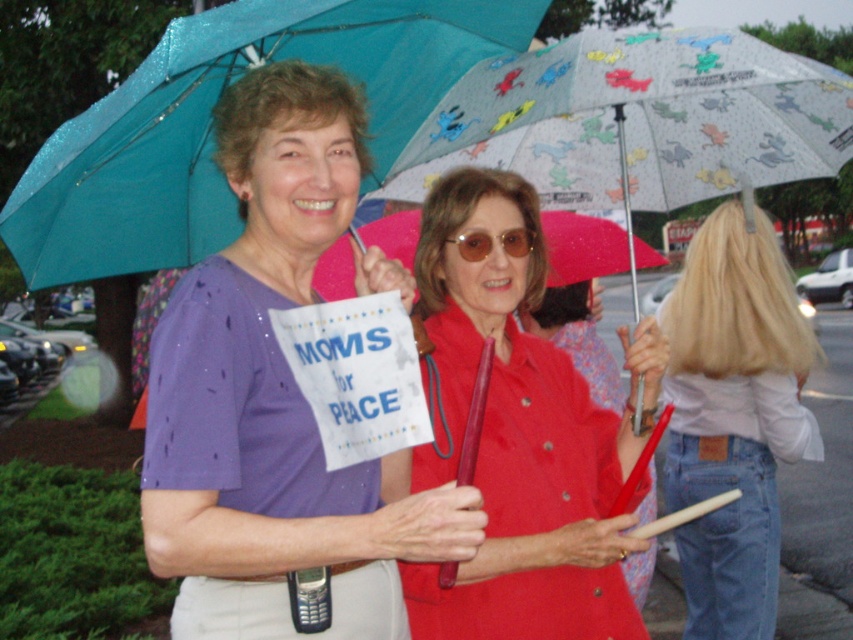
Does purple fabric shirt at upper left lie behind matte red shirt at center?

No, purple fabric shirt at upper left is closer to the viewer.

How far apart are purple fabric shirt at upper left and matte red shirt at center?

The distance of purple fabric shirt at upper left from matte red shirt at center is 13.88 inches.

Image resolution: width=853 pixels, height=640 pixels. Find the location of `purple fabric shirt at upper left`. purple fabric shirt at upper left is located at coordinates (276, 397).

I want to click on purple fabric shirt at upper left, so click(276, 397).

Can you confirm if matte red shirt at center is taller than teal fabric umbrella at upper left?

Yes.

Can you confirm if matte red shirt at center is positioned above teal fabric umbrella at upper left?

Incorrect, matte red shirt at center is not positioned above teal fabric umbrella at upper left.

In order to click on matte red shirt at center in this screenshot , I will do `click(521, 436)`.

Between matte red shirt at center and sunglassesmatte at center, which one has less height?

Standing shorter between the two is sunglassesmatte at center.

Is matte red shirt at center below sunglassesmatte at center?

Yes, matte red shirt at center is below sunglassesmatte at center.

Who is more distant from viewer, (x=506, y=273) or (x=527, y=241)?

Positioned behind is point (x=527, y=241).

Identify the location of matte red shirt at center. The width and height of the screenshot is (853, 640). (521, 436).